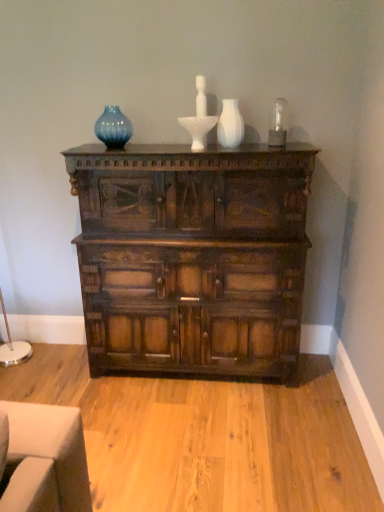
You are a GUI agent. You are given a task and a screenshot of the screen. Output one action in this format:
    pyautogui.click(x=<x>, y=<y>)
    Task: Click on the free space in front of dark wood chest of drawers at center
    
    Given the screenshot: What is the action you would take?
    pyautogui.click(x=210, y=441)